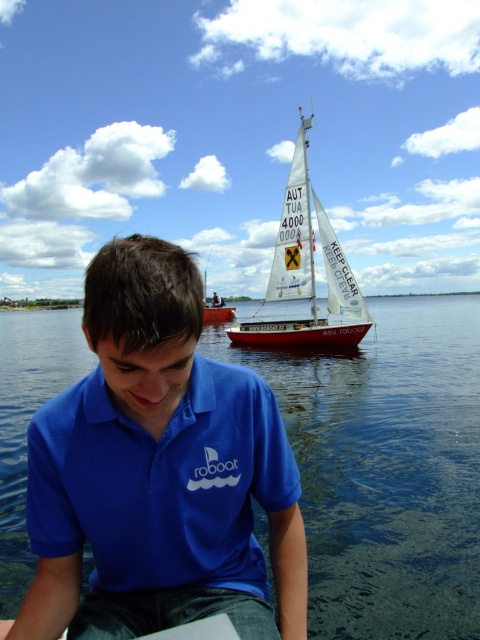
Looking at this image, is transparent blue water at lower center wider than white sailboat at upper center?

Indeed, transparent blue water at lower center has a greater width compared to white sailboat at upper center.

Who is positioned more to the right, transparent blue water at lower center or white sailboat at upper center?

transparent blue water at lower center

Measure the distance between transparent blue water at lower center and camera.

transparent blue water at lower center is 4.50 meters from camera.

At what (x,y) coordinates should I click in order to perform the action: click on transparent blue water at lower center. Please return your answer as a coordinate pair (x, y). Looking at the image, I should click on (385, 468).

Which is behind, point (223, 419) or point (307, 164)?

The point (307, 164) is more distant.

Is blue cotton polo shirt at center positioned at the back of white sailboat at upper center?

That is False.

This screenshot has width=480, height=640. I want to click on blue cotton polo shirt at center, so click(x=160, y=483).

Measure the distance between transparent blue water at lower center and blue cotton polo shirt at center.

They are 8.84 meters apart.

In the scene shown: Can you confirm if transparent blue water at lower center is thinner than blue cotton polo shirt at center?

No, transparent blue water at lower center is not thinner than blue cotton polo shirt at center.

Does point (420, 529) come behind point (35, 458)?

Yes, point (420, 529) is farther from viewer.

At what (x,y) coordinates should I click in order to perform the action: click on transparent blue water at lower center. Please return your answer as a coordinate pair (x, y). Looking at the image, I should click on (385, 468).